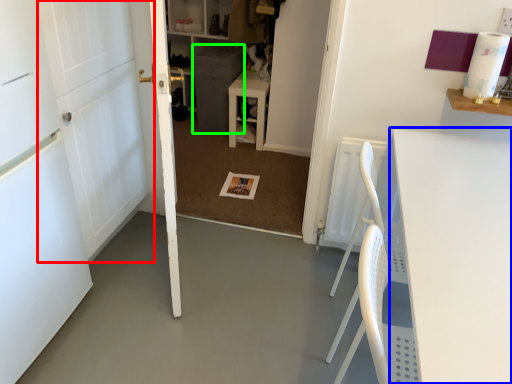
Question: Which object is positioned farthest from door (highlighted by a red box)? Select from table (highlighted by a blue box) and cabinetry (highlighted by a green box).

Choices:
 (A) table
 (B) cabinetry

Answer: (B)